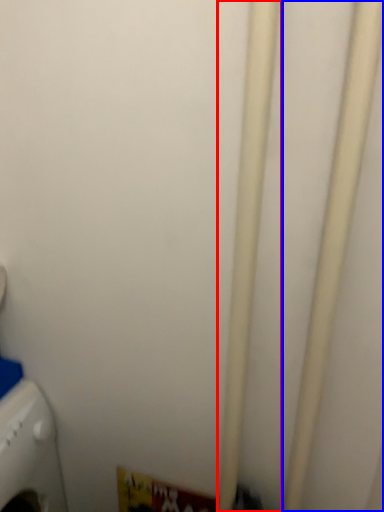
Question: Which object is further to the camera taking this photo, pipe (highlighted by a red box) or pipe (highlighted by a blue box)?

Choices:
 (A) pipe
 (B) pipe

Answer: (A)